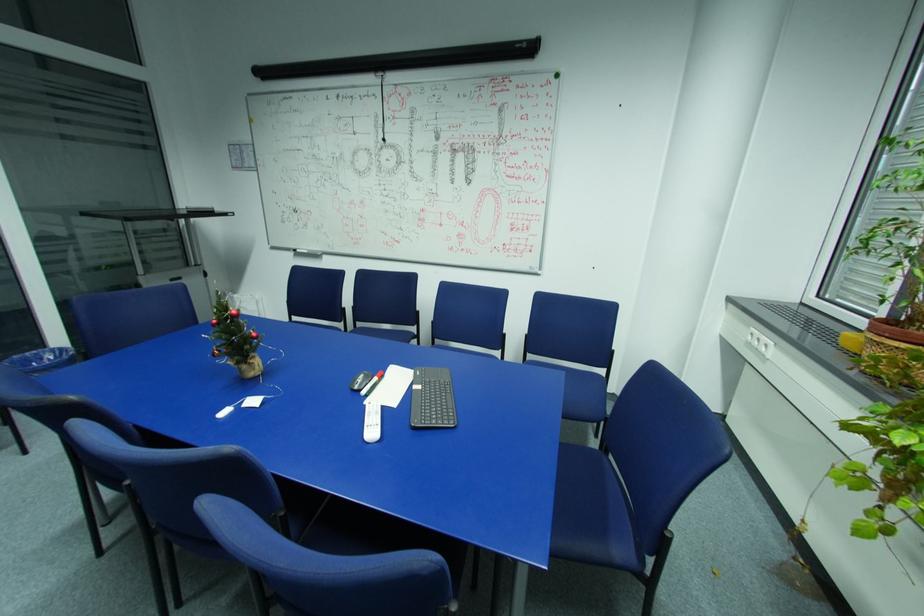
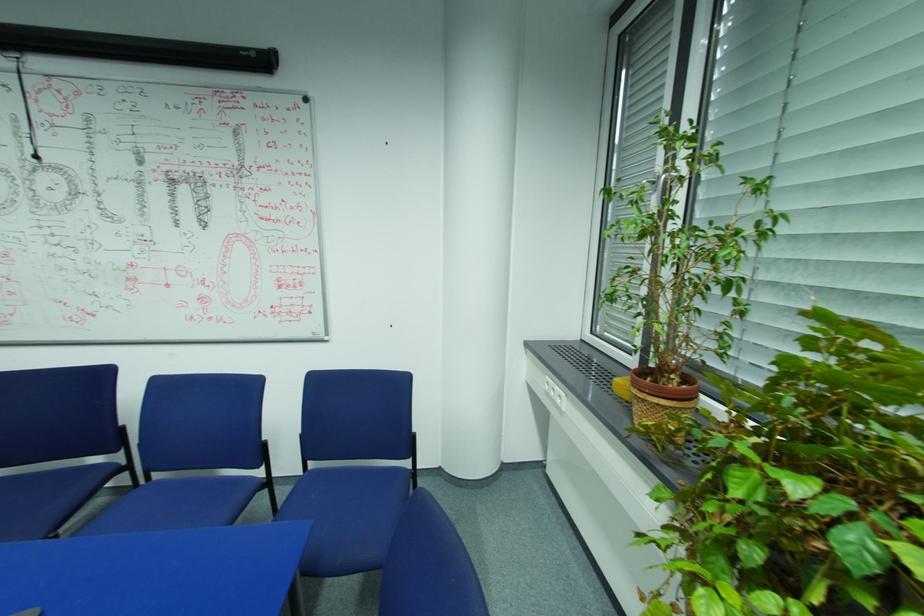
The images are taken continuously from a first-person perspective. In which direction are you moving?

The cameraman moved toward right, forward.